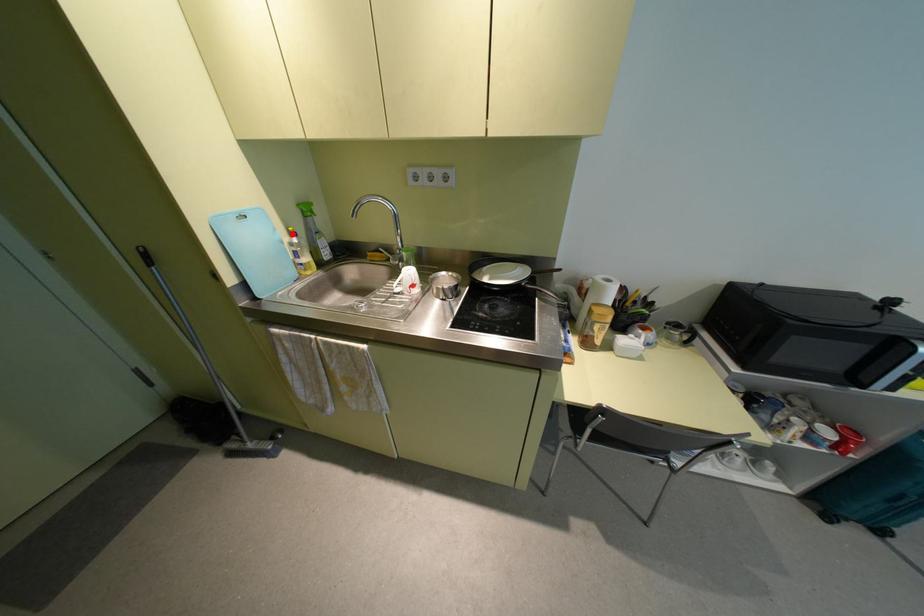
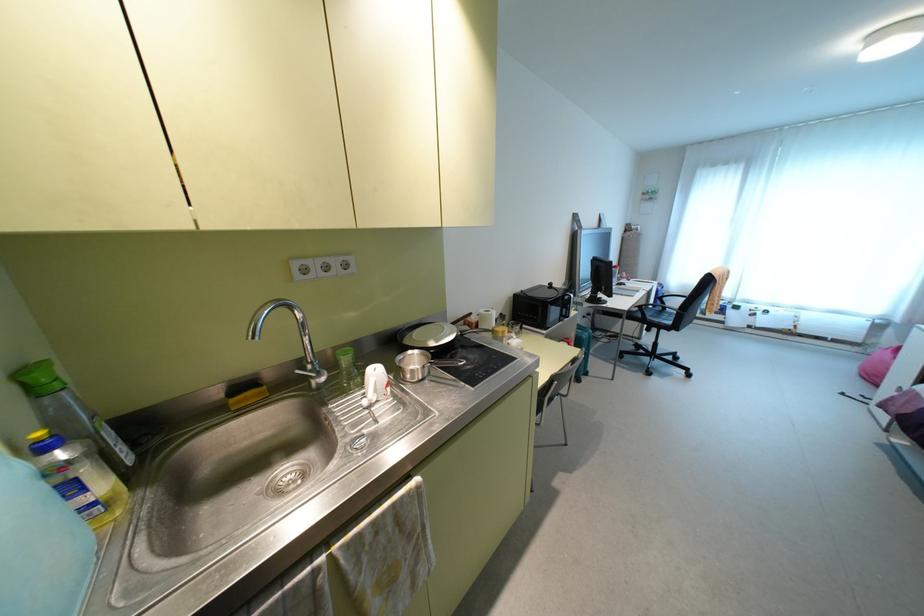
Question: I am providing you with two images of the same scene from different viewpoints. Image1 has a red point marked. In image2, the corresponding 3D location appears at what relative position? Reply with the corresponding letter.

Choices:
 (A) Closer
 (B) Farther

Answer: (B)